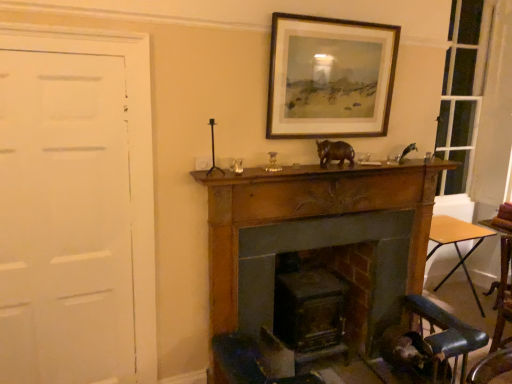
Question: Does point (407, 148) appear closer or farther from the camera than point (473, 230)?

Choices:
 (A) closer
 (B) farther

Answer: (A)

Question: Visually, is metallic silver bird at upper right, which is the first animal from right to left, positioned to the left or to the right of wooden at right?

Choices:
 (A) right
 (B) left

Answer: (B)

Question: Based on their relative distances, which object is farther from the brown matte rhino at center, the 2th animal when ordered from right to left?

Choices:
 (A) wooden at right
 (B) smooth wood fireplace at center, which is the 2th fireplace in back-to-front order
 (C) wooden framed painting at upper center
 (D) brown wooden mantle at center
 (E) white matte door at left

Answer: (A)

Question: Which of these objects is positioned closest to the smooth wood fireplace at center, which appears as the first fireplace when viewed from the front?

Choices:
 (A) brown matte rhino at center, acting as the 1th animal starting from the left
 (B) wooden folding table at lower right
 (C) wooden framed painting at upper center
 (D) brown wooden mantle at center
 (E) white matte door at left

Answer: (D)